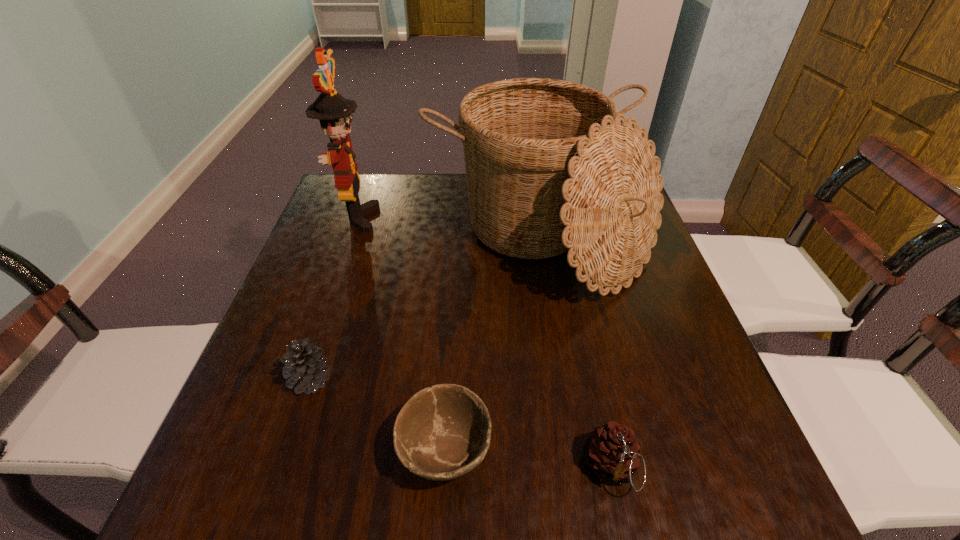
Identify the location of nutcracker positioned at the far edge. (334, 112).

You are a GUI agent. You are given a task and a screenshot of the screen. Output one action in this format:
    pyautogui.click(x=<x>, y=<y>)
    Task: Click on the basket that is at the far edge
    This screenshot has width=960, height=540.
    Given the screenshot: What is the action you would take?
    pyautogui.click(x=549, y=168)

You are a GUI agent. You are given a task and a screenshot of the screen. Output one action in this format:
    pyautogui.click(x=<x>, y=<y>)
    Task: Click on the pinecone that is at the near edge
    The width and height of the screenshot is (960, 540).
    Given the screenshot: What is the action you would take?
    pyautogui.click(x=612, y=452)

In order to click on bowl that is at the near edge in this screenshot , I will do `click(443, 432)`.

This screenshot has height=540, width=960. Find the location of `nutcracker at the left edge`. nutcracker at the left edge is located at coordinates (334, 112).

Image resolution: width=960 pixels, height=540 pixels. I want to click on pinecone that is at the left edge, so click(305, 365).

At what (x,y) coordinates should I click in order to perform the action: click on object positioned at the right edge. Please return your answer as a coordinate pair (x, y). Looking at the image, I should click on coord(549,168).

Identify the location of object situated at the far left corner. (334, 112).

Image resolution: width=960 pixels, height=540 pixels. Find the location of `object that is at the far right corner`. object that is at the far right corner is located at coordinates (549, 168).

You are a GUI agent. You are given a task and a screenshot of the screen. Output one action in this format:
    pyautogui.click(x=<x>, y=<y>)
    Task: Click on the vacant region at the near edge of the desktop
    
    Given the screenshot: What is the action you would take?
    pyautogui.click(x=612, y=492)